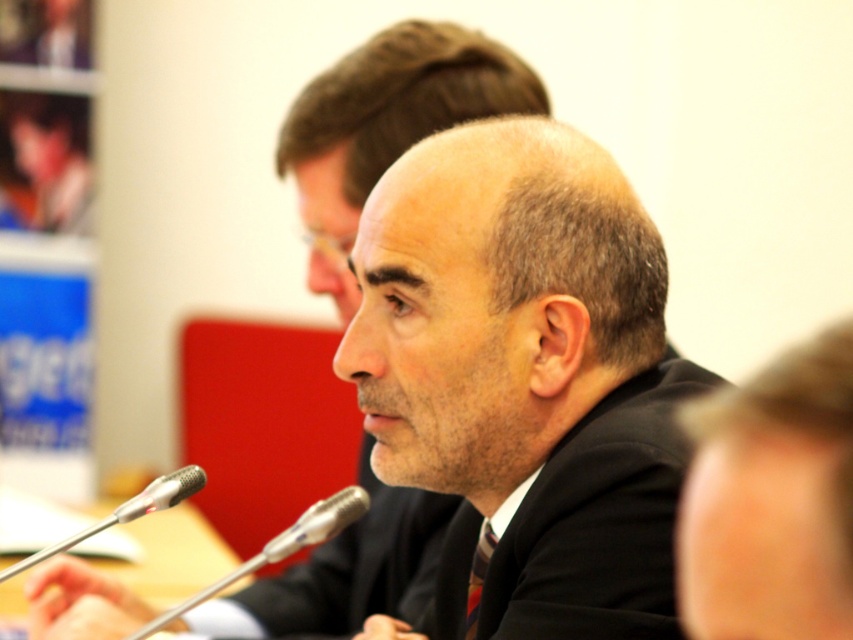
You are standing at the entrance of the conference room and see the point marked at coordinates (770, 500). What object is located at that point?

The point at coordinates (770, 500) corresponds to the smooth black suit at center.

You are organizing a photo shoot and need to place a small prop exactly at the coordinates mentioned in the scene description. Where should you place the prop relative to the dark suit at center?

The prop should be placed at the coordinates point (527, 369) where the dark suit at center is located.

You are an event organizer and need to place a 0.5 meter wide decorative stand between the smooth black suit at center and the nearest microphone. Is there enough space?

The smooth black suit at center is located at point (x=770, y=500). Since the exact position of the microphones isn,t provided, I can,t determine the distance between them. Please provide more information about the microphones location to proceed.